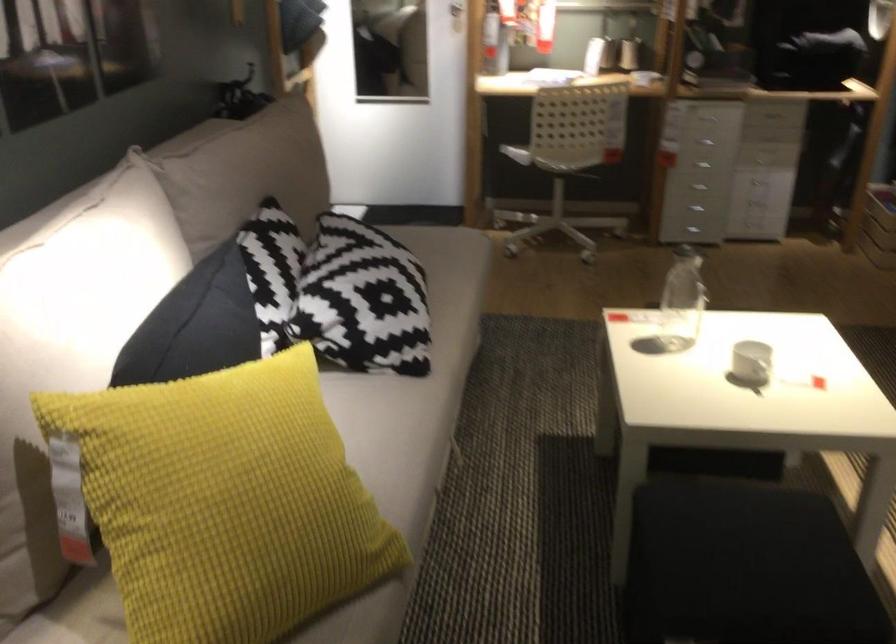
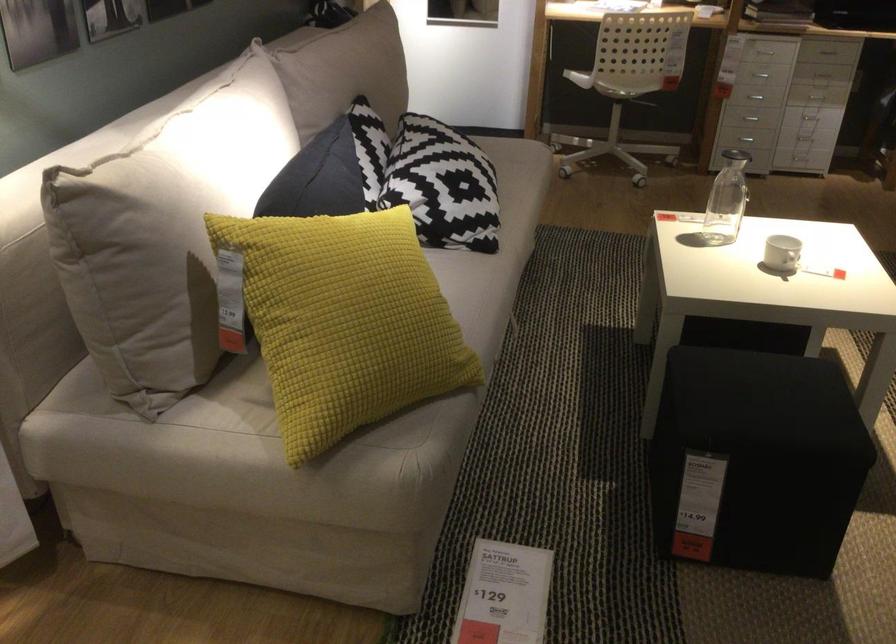
Where in the second image is the point corresponding to point 213,524 from the first image?

(343, 321)